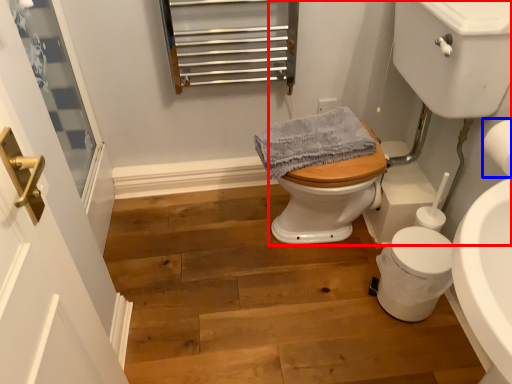
Question: Among these objects, which one is farthest to the camera, sink (highlighted by a red box) or toilet paper (highlighted by a blue box)?

Choices:
 (A) sink
 (B) toilet paper

Answer: (B)